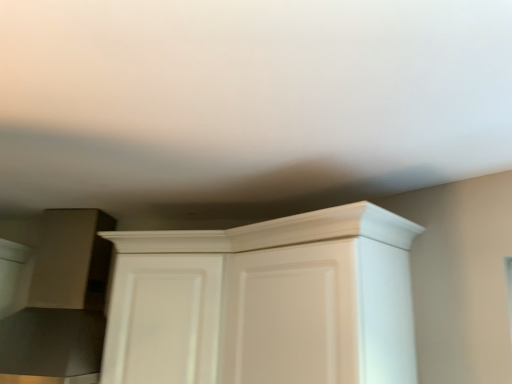
What do you see at coordinates (265, 302) in the screenshot? The width and height of the screenshot is (512, 384). I see `white matte cupboard at center` at bounding box center [265, 302].

I want to click on white matte cupboard at center, so click(x=265, y=302).

Measure the distance between white glossy cabinet at center and camera.

A distance of 4.48 feet exists between white glossy cabinet at center and camera.

Where is `white glossy cabinet at center`? white glossy cabinet at center is located at coordinates (163, 319).

What do you see at coordinates (163, 319) in the screenshot?
I see `white glossy cabinet at center` at bounding box center [163, 319].

Measure the distance between point (x=160, y=261) and camera.

Point (x=160, y=261) is 4.97 feet from camera.

This screenshot has width=512, height=384. I want to click on white matte cupboard at center, so click(265, 302).

Can you confirm if white matte cupboard at center is positioned to the right of white glossy cabinet at center?

Yes.

Is white matte cupboard at center in front of or behind white glossy cabinet at center in the image?

white matte cupboard at center is in front of white glossy cabinet at center.

Which is closer to the camera, (387, 213) or (182, 299)?

Point (387, 213) is positioned closer to the camera compared to point (182, 299).

Consider the image. From the image's perspective, is white matte cupboard at center located above white glossy cabinet at center?

Correct, white matte cupboard at center appears higher than white glossy cabinet at center in the image.

Consider the image. From a real-world perspective, is white matte cupboard at center physically located above or below white glossy cabinet at center?

In terms of real-world spatial position, white matte cupboard at center is below white glossy cabinet at center.

Considering the sizes of white matte cupboard at center and white glossy cabinet at center in the image, is white matte cupboard at center wider or thinner than white glossy cabinet at center?

Considering their sizes, white matte cupboard at center looks broader than white glossy cabinet at center.

Considering the sizes of objects white matte cupboard at center and white glossy cabinet at center in the image provided, who is shorter, white matte cupboard at center or white glossy cabinet at center?

Standing shorter between the two is white glossy cabinet at center.

Does white matte cupboard at center have a larger size compared to white glossy cabinet at center?

Yes.

Can we say white matte cupboard at center lies outside white glossy cabinet at center?

Indeed, white matte cupboard at center is completely outside white glossy cabinet at center.

Is white matte cupboard at center next to white glossy cabinet at center and touching it?

No, white matte cupboard at center is not in contact with white glossy cabinet at center.

Could you tell me if white matte cupboard at center is facing white glossy cabinet at center?

Yes, white matte cupboard at center is aimed at white glossy cabinet at center.

How many degrees apart are the facing directions of white matte cupboard at center and white glossy cabinet at center?

There is a 35.8-degree angle between the facing directions of white matte cupboard at center and white glossy cabinet at center.

How much distance is there between white matte cupboard at center and white glossy cabinet at center?

5.20 inches.

This screenshot has width=512, height=384. I want to click on cupboard above the white glossy cabinet at center (from the image's perspective), so click(265, 302).

Considering the relative positions of white glossy cabinet at center and white matte cupboard at center in the image provided, is white glossy cabinet at center to the right of white matte cupboard at center from the viewer's perspective?

Incorrect, white glossy cabinet at center is not on the right side of white matte cupboard at center.

Which object is closer to the camera taking this photo, white glossy cabinet at center or white matte cupboard at center?

white matte cupboard at center is in front.

Which is less distant, [201,372] or [297,341]?

Point [201,372] is farther from the camera than point [297,341].

From the image's perspective, does white glossy cabinet at center appear lower than white matte cupboard at center?

Correct, white glossy cabinet at center appears lower than white matte cupboard at center in the image.

From a real-world perspective, is white glossy cabinet at center positioned above or below white matte cupboard at center?

white glossy cabinet at center is above white matte cupboard at center.

Considering the relative sizes of white glossy cabinet at center and white matte cupboard at center in the image provided, is white glossy cabinet at center thinner than white matte cupboard at center?

Yes, white glossy cabinet at center is thinner than white matte cupboard at center.

Considering the relative sizes of white glossy cabinet at center and white matte cupboard at center in the image provided, is white glossy cabinet at center taller than white matte cupboard at center?

No.

Can you confirm if white glossy cabinet at center is bigger than white matte cupboard at center?

No, white glossy cabinet at center is not bigger than white matte cupboard at center.

From the picture: Is white glossy cabinet at center positioned beyond the bounds of white matte cupboard at center?

Actually, white glossy cabinet at center is at least partially inside white matte cupboard at center.

Is the surface of white glossy cabinet at center in direct contact with white matte cupboard at center?

No, white glossy cabinet at center is not touching white matte cupboard at center.

Is white glossy cabinet at center looking in the opposite direction of white matte cupboard at center?

That's right, white glossy cabinet at center is facing away from white matte cupboard at center.

How many degrees apart are the facing directions of white glossy cabinet at center and white matte cupboard at center?

There is a 35.8-degree angle between the facing directions of white glossy cabinet at center and white matte cupboard at center.

Measure the distance between white glossy cabinet at center and white matte cupboard at center.

5.20 inches.

Find the location of `door that appears on the left of white matte cupboard at center`. door that appears on the left of white matte cupboard at center is located at coordinates pyautogui.click(x=163, y=319).

Where is `cupboard below the white glossy cabinet at center (from a real-world perspective)`? cupboard below the white glossy cabinet at center (from a real-world perspective) is located at coordinates (265, 302).

Locate an element on the screen. The image size is (512, 384). door positioned vertically above the white matte cupboard at center (from a real-world perspective) is located at coordinates (163, 319).